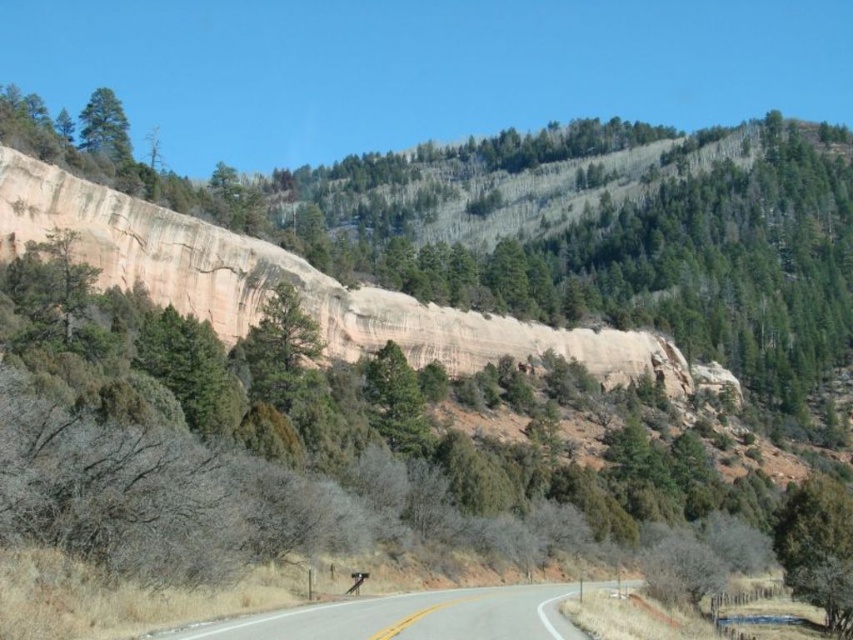
Question: Which object appears farthest from the camera in this image?

Choices:
 (A) green matte tree at upper left
 (B) smooth asphalt road at center

Answer: (A)

Question: Can you confirm if smooth asphalt road at center is smaller than green matte tree at upper left?

Choices:
 (A) no
 (B) yes

Answer: (B)

Question: Is smooth asphalt road at center above green matte tree at upper left?

Choices:
 (A) no
 (B) yes

Answer: (A)

Question: In this image, where is smooth asphalt road at center located relative to green matte tree at upper left?

Choices:
 (A) left
 (B) right

Answer: (B)

Question: Which point appears closest to the camera in this image?

Choices:
 (A) (427, 625)
 (B) (108, 128)

Answer: (A)